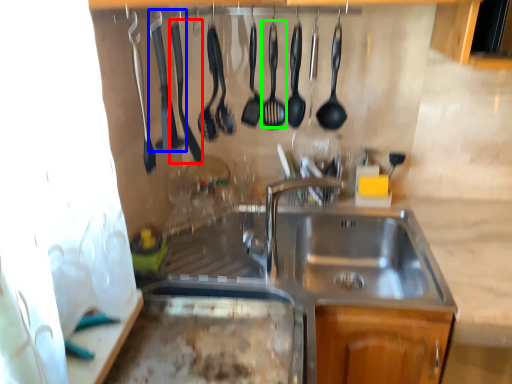
Question: Which object is positioned farthest from silverware (highlighted by a red box)? Select from silverware (highlighted by a blue box) and utensil (highlighted by a green box).

Choices:
 (A) silverware
 (B) utensil

Answer: (B)